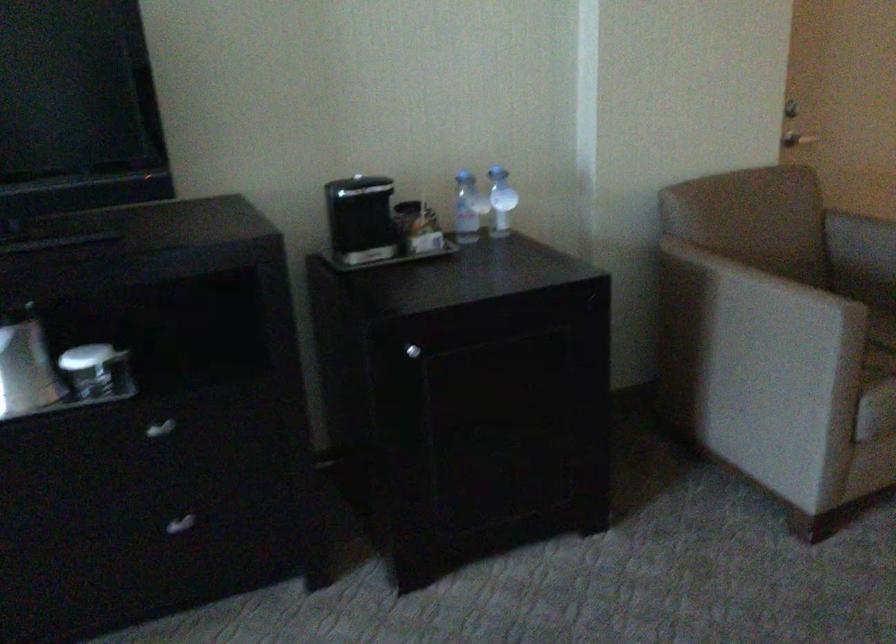
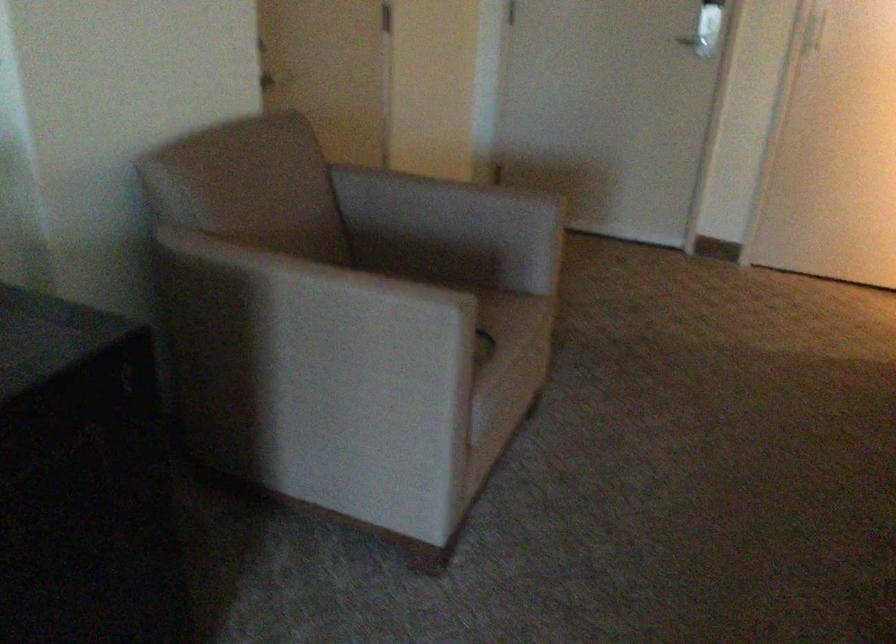
Where in the second image is the point corresponding to pixel 742 310 from the first image?

(314, 325)